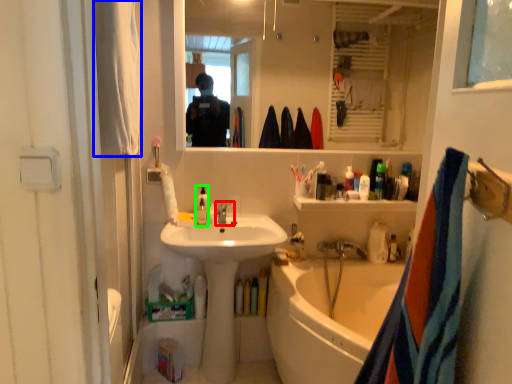
Question: Estimate the real-world distances between objects in this image. Which object is farther from faucet (highlighted by a red box), towel/napkin (highlighted by a blue box) or bottle (highlighted by a green box)?

Choices:
 (A) towel/napkin
 (B) bottle

Answer: (A)